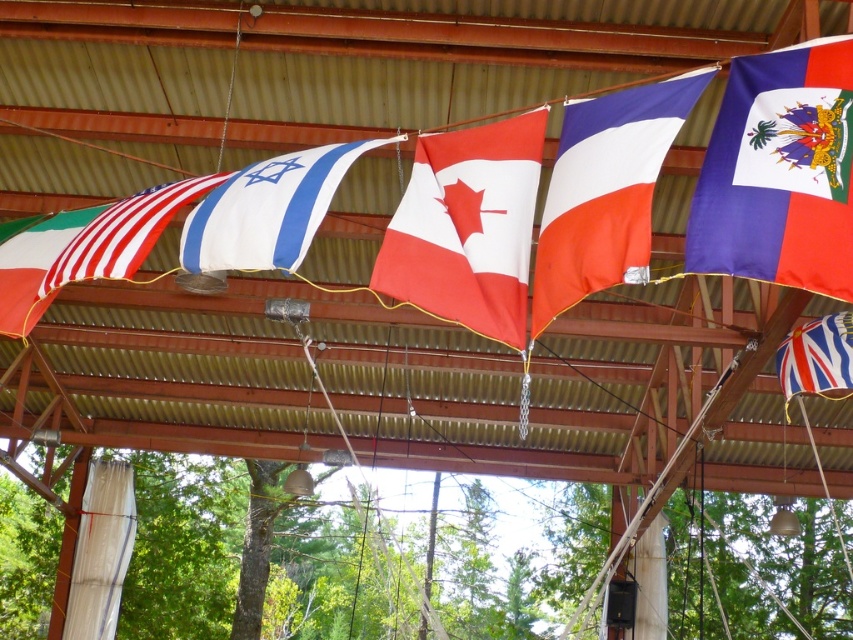
Does red/white fabric canadian flag at center appear over white cotton flag at center?

No.

Which is behind, point (514, 292) or point (612, 99)?

Positioned behind is point (612, 99).

Find the location of a particular element. The width and height of the screenshot is (853, 640). red/white fabric canadian flag at center is located at coordinates (467, 227).

Does point (194, 182) come closer to viewer compared to point (312, 156)?

No.

Can you confirm if matte white flag at left is bigger than white fabric flag at center?

Indeed, matte white flag at left has a larger size compared to white fabric flag at center.

What do you see at coordinates (83, 246) in the screenshot? The image size is (853, 640). I see `matte white flag at left` at bounding box center [83, 246].

This screenshot has height=640, width=853. Find the location of `matte white flag at left`. matte white flag at left is located at coordinates (83, 246).

Is white cotton flag at center below striped cotton flag at upper right?

No.

Can you confirm if white cotton flag at center is smaller than striped cotton flag at upper right?

Actually, white cotton flag at center might be larger than striped cotton flag at upper right.

Who is more distant from viewer, (561, 252) or (807, 356)?

Positioned behind is point (807, 356).

Locate an element on the screen. The height and width of the screenshot is (640, 853). white cotton flag at center is located at coordinates (605, 192).